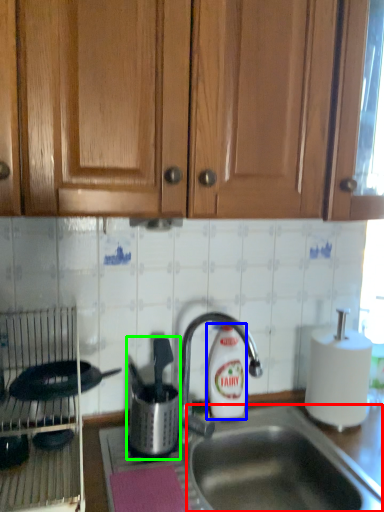
Question: Which object is positioned closest to sink (highlighted by a red box)? Select from cleaning product (highlighted by a blue box) and appliance (highlighted by a green box).

Choices:
 (A) cleaning product
 (B) appliance

Answer: (A)